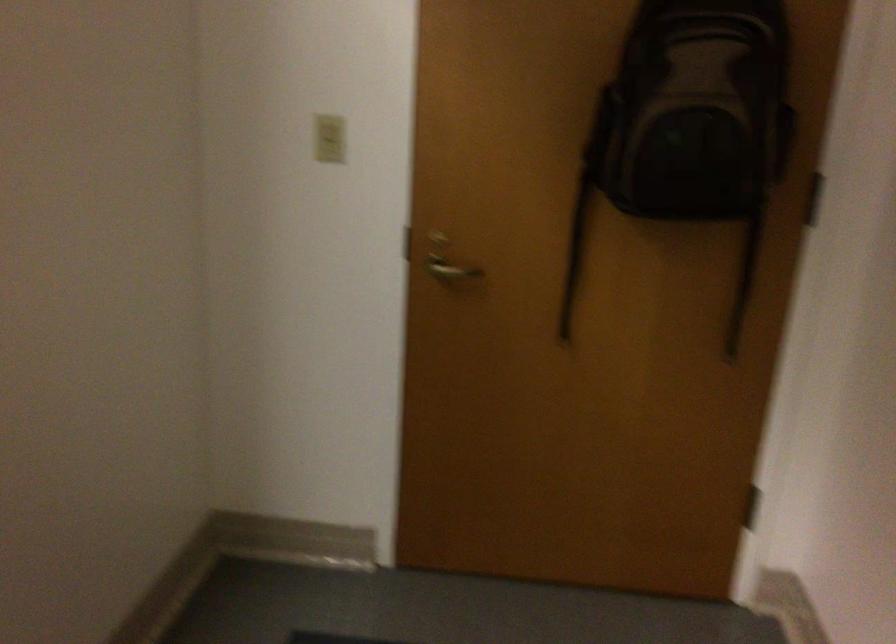
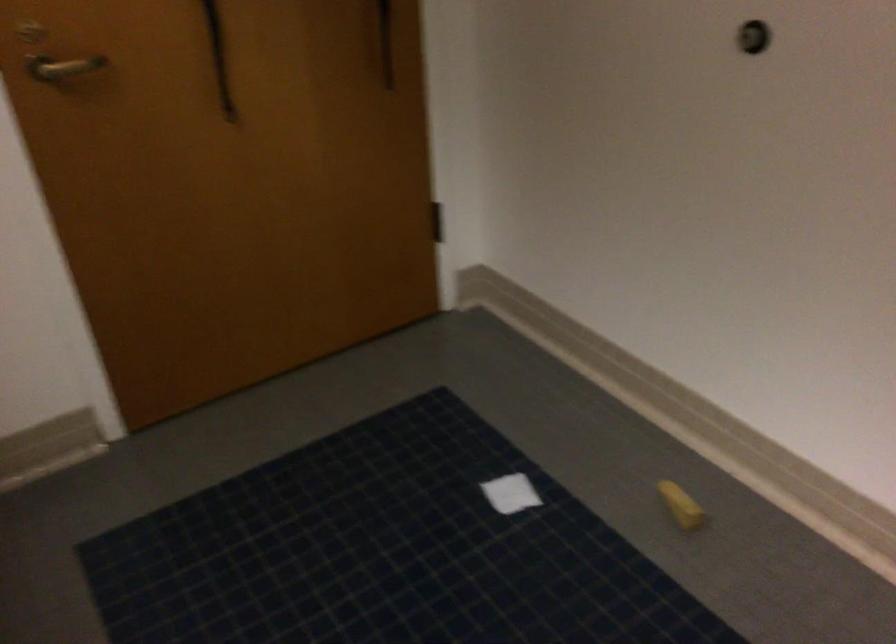
The point at [739,315] is marked in the first image. Where is the corresponding point in the second image?

(384, 42)